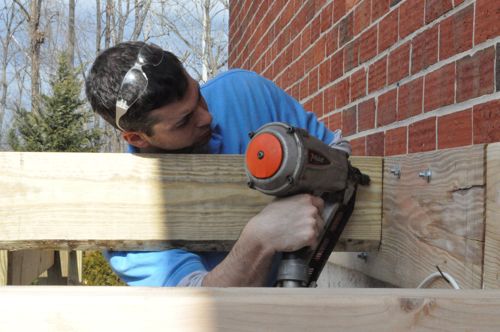
I want to click on brick wall, so click(355, 66).